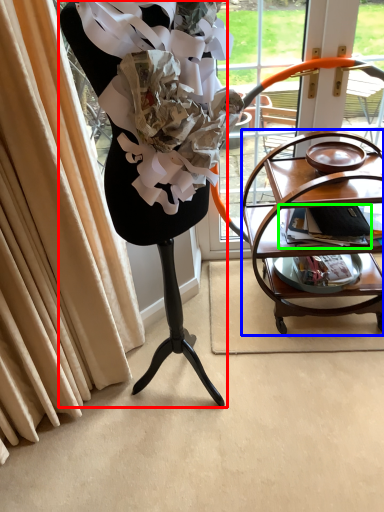
Question: Considering the real-world distances, which object is closest to furniture (highlighted by a red box)? table (highlighted by a blue box) or magazine (highlighted by a green box).

Choices:
 (A) table
 (B) magazine

Answer: (A)